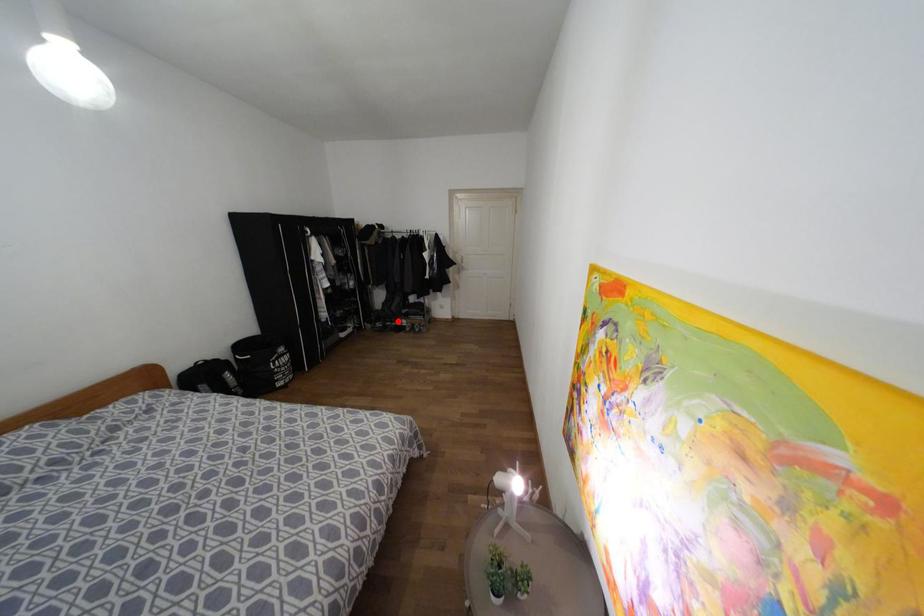
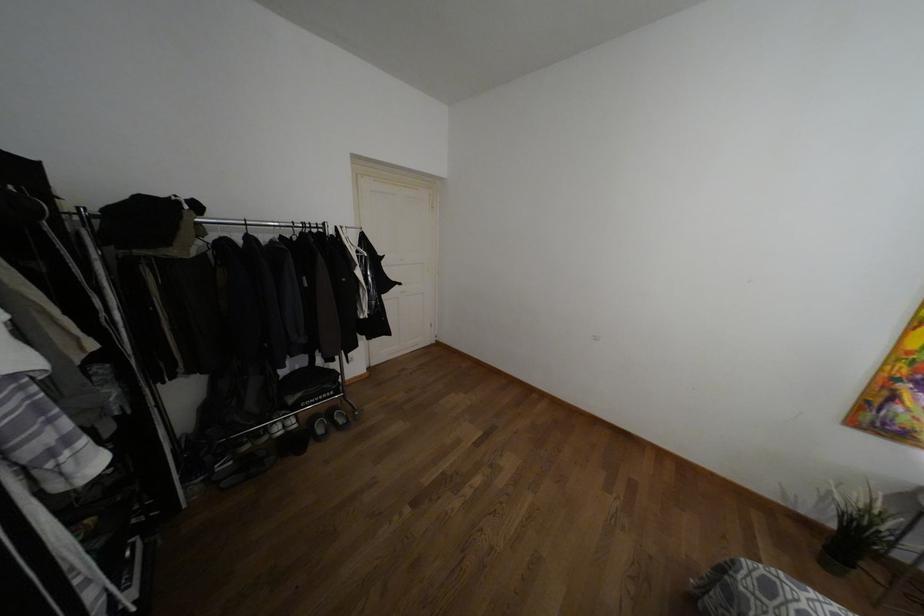
Question: I am providing you with two images of the same scene from different viewpoints. In image1, a red point is highlighted. Considering the same 3D point in image2, which of the following is correct?

Choices:
 (A) It is closer
 (B) It is farther

Answer: (B)